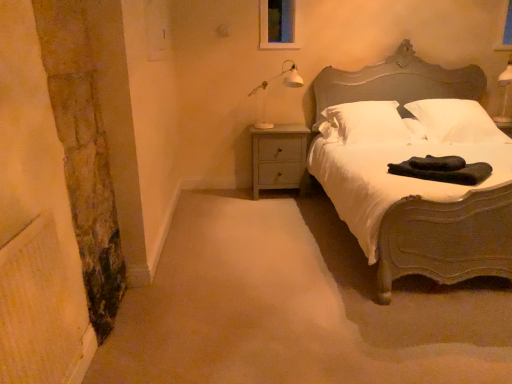
Question: Considering the relative sizes of dark green fabric at bed and white soft pillow at center, the 2th pillow positioned from the right, in the image provided, is dark green fabric at bed thinner than white soft pillow at center, the 2th pillow positioned from the right,?

Choices:
 (A) no
 (B) yes

Answer: (B)

Question: Is dark green fabric at bed positioned far away from white soft pillow at center, the 1th pillow from the left?

Choices:
 (A) yes
 (B) no

Answer: (B)

Question: Considering the relative positions of dark green fabric at bed and white soft pillow at center, the 2th pillow positioned from the right, in the image provided, is dark green fabric at bed behind white soft pillow at center, the 2th pillow positioned from the right,?

Choices:
 (A) no
 (B) yes

Answer: (A)

Question: Would you say white soft pillow at center, the 1th pillow from the left, is part of dark green fabric at bed's contents?

Choices:
 (A) no
 (B) yes

Answer: (A)

Question: Considering the relative positions of dark green fabric at bed and white soft pillow at center, the 1th pillow from the left, in the image provided, is dark green fabric at bed to the left of white soft pillow at center, the 1th pillow from the left, from the viewer's perspective?

Choices:
 (A) no
 (B) yes

Answer: (A)

Question: Does dark green fabric at bed have a greater width compared to white soft pillow at center, the 1th pillow from the left?

Choices:
 (A) no
 (B) yes

Answer: (A)

Question: Is matte gray bed at right positioned before white soft pillow at upper right, which ranks as the 1th pillow in right-to-left order?

Choices:
 (A) no
 (B) yes

Answer: (B)

Question: Is matte gray bed at right thinner than white soft pillow at upper right, which ranks as the 1th pillow in right-to-left order?

Choices:
 (A) no
 (B) yes

Answer: (A)

Question: Is matte gray bed at right facing away from white soft pillow at upper right, the second pillow positioned from the left?

Choices:
 (A) yes
 (B) no

Answer: (A)

Question: Can we say matte gray bed at right lies outside white soft pillow at upper right, which ranks as the 1th pillow in right-to-left order?

Choices:
 (A) no
 (B) yes

Answer: (B)

Question: From a real-world perspective, is matte gray bed at right under white soft pillow at upper right, which ranks as the 1th pillow in right-to-left order?

Choices:
 (A) no
 (B) yes

Answer: (B)

Question: Does matte gray bed at right have a smaller size compared to white soft pillow at upper right, which ranks as the 1th pillow in right-to-left order?

Choices:
 (A) no
 (B) yes

Answer: (A)

Question: Considering the relative sizes of dark green fabric at bed and white glossy lamp at upper right in the image provided, is dark green fabric at bed wider than white glossy lamp at upper right?

Choices:
 (A) yes
 (B) no

Answer: (A)